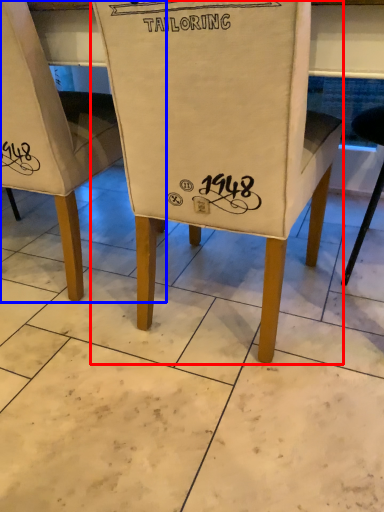
Question: Which point is further to the camera, chair (highlighted by a red box) or chair (highlighted by a blue box)?

Choices:
 (A) chair
 (B) chair

Answer: (B)